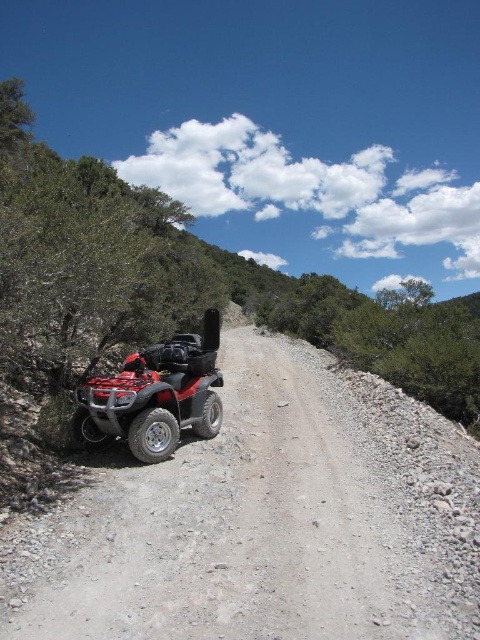
Does dirt gravel at left appear over red matte quad bike at left?

Actually, dirt gravel at left is below red matte quad bike at left.

Does dirt gravel at left have a smaller size compared to red matte quad bike at left?

No.

Who is more forward, [350,445] or [95,420]?

Point [95,420] is more forward.

The height and width of the screenshot is (640, 480). In order to click on dirt gravel at left in this screenshot , I will do coord(264,520).